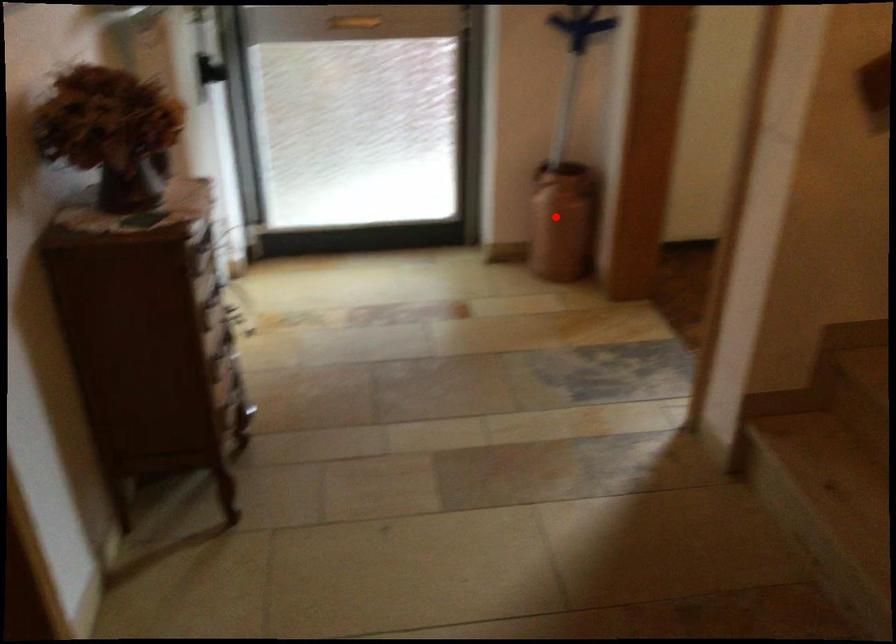
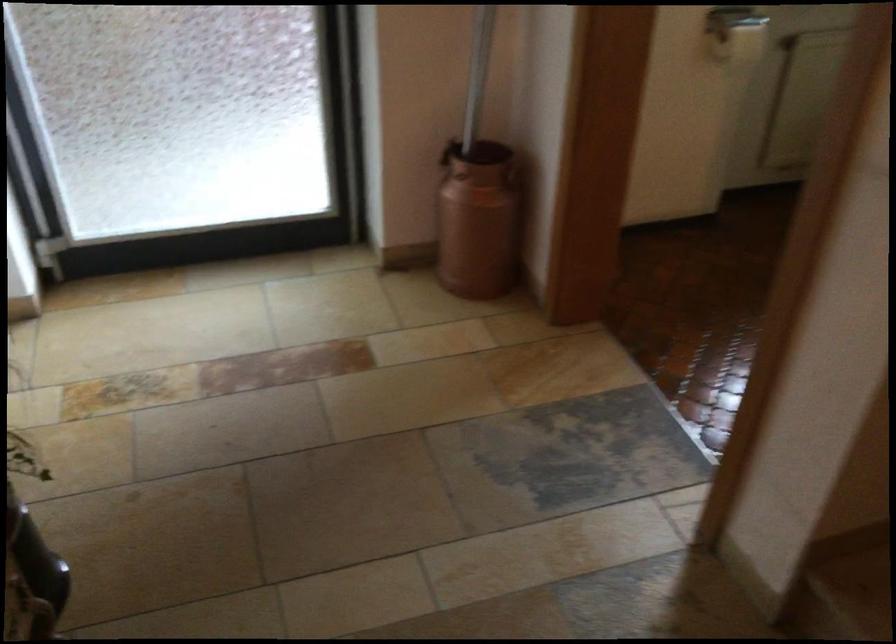
Question: A red point is marked in image1. In image2, is the corresponding 3D point closer to the camera or farther? Reply with the corresponding letter.

Choices:
 (A) The corresponding 3D point is closer.
 (B) The corresponding 3D point is farther.

Answer: (A)